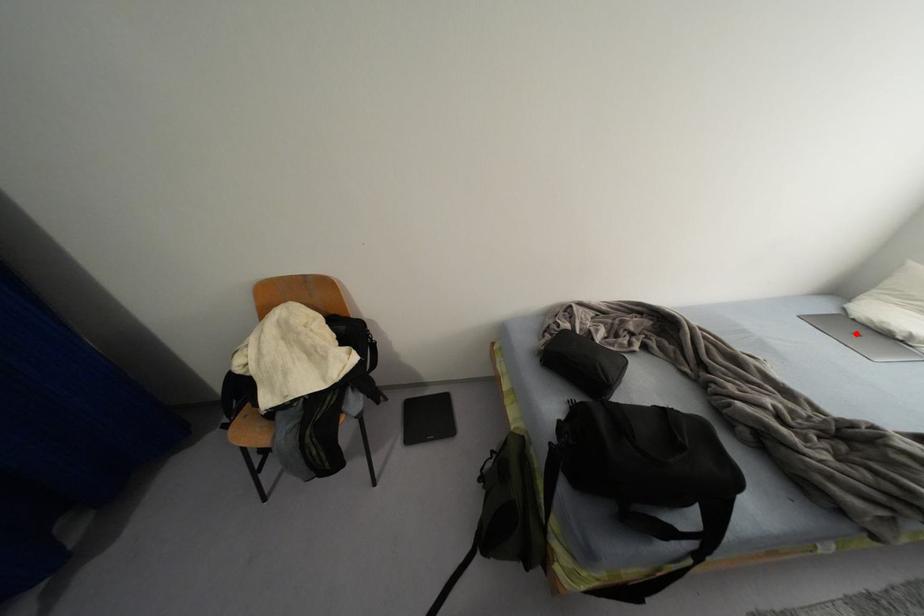
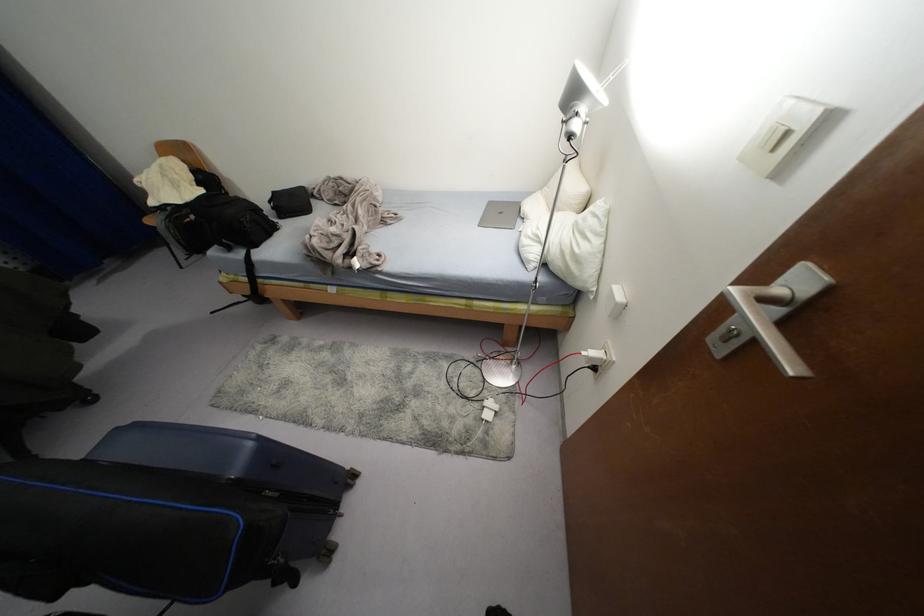
In the second image, find the point that corresponds to the highlighted location in the first image.

(500, 213)